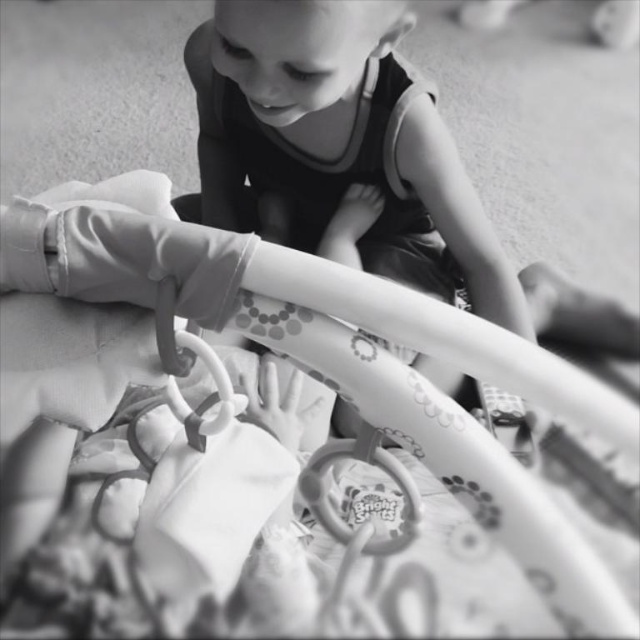
You are a parent trying to store the rubber teething ring at center and the patterned plastic infant bed at center in a closet. Which item will require more space in the closet?

The patterned plastic infant bed at center is bigger than the rubber teething ring at center, so it will require more space in the closet.

Looking at this image, you are a parent trying to clean the baby bouncer. You need to remove the rubber teething ring at center first before you can access the patterned plastic infant bed at center for cleaning. Is this possible?

The patterned plastic infant bed at center is located above the rubber teething ring at center, so you cannot remove the rubber teething ring at center first because it is underneath the bed.

You are a parent who wants to place a small toy between the patterned plastic infant bed at center and the rubber teething ring at center. Which object should you place the toy closer to in order to ensure it doesn

The patterned plastic infant bed at center is taller than the rubber teething ring at center, so you should place the toy closer to the rubber teething ring at center to ensure it is within reach of the child.